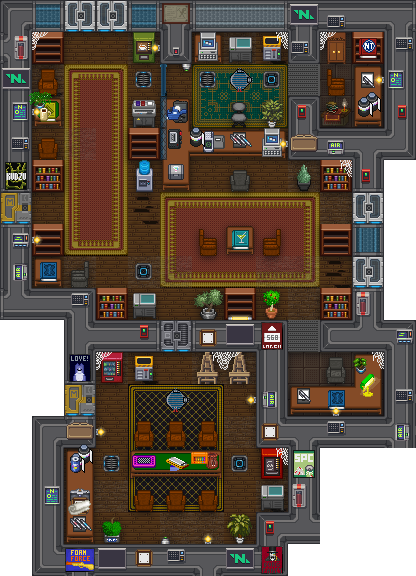
Image resolution: width=416 pixels, height=576 pixels. Identify the location of shelves. (143, 140), (46, 56), (43, 184), (51, 238), (114, 304), (333, 242), (333, 309), (230, 297), (329, 181), (380, 45).